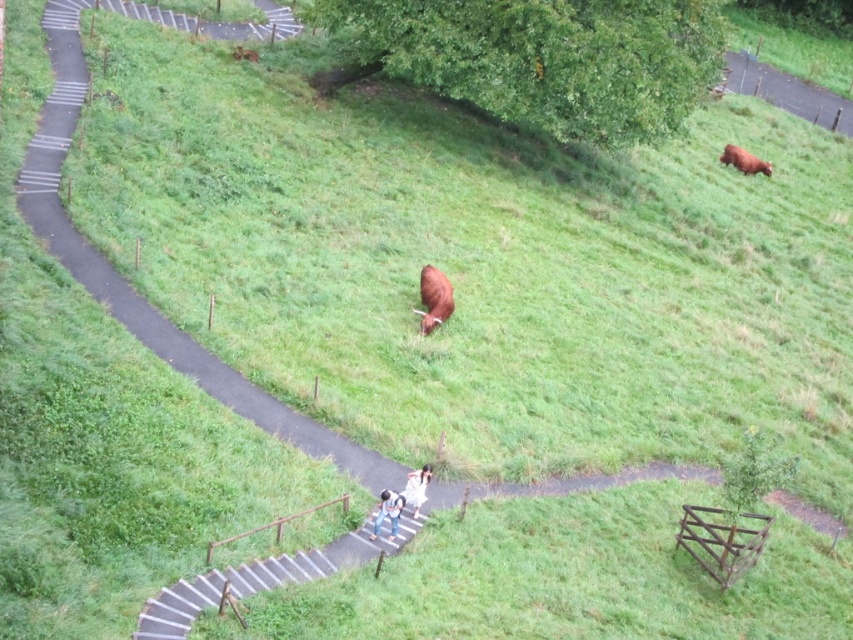
Question: Can you confirm if blue denim jeans at center is positioned to the right of brown matte cow at upper right?

Choices:
 (A) no
 (B) yes

Answer: (A)

Question: Which object appears closest to the camera in this image?

Choices:
 (A) metallic gray stairs at lower center
 (B) white fabric at center
 (C) brown matte cow at upper right
 (D) brown furry cow at center

Answer: (A)

Question: Is metallic gray stairs at lower center to the right of brown furry cow at center from the viewer's perspective?

Choices:
 (A) no
 (B) yes

Answer: (A)

Question: Which is nearer to the brown furry cow at center?

Choices:
 (A) blue denim jeans at center
 (B) white fabric at center
 (C) brown matte cow at upper right
 (D) metallic gray stairs at lower center

Answer: (B)

Question: From the image, what is the correct spatial relationship of blue denim jeans at center in relation to white fabric at center?

Choices:
 (A) left
 (B) right

Answer: (A)

Question: Which point appears farthest from the camera in this image?

Choices:
 (A) coord(447,292)
 (B) coord(171,602)

Answer: (A)